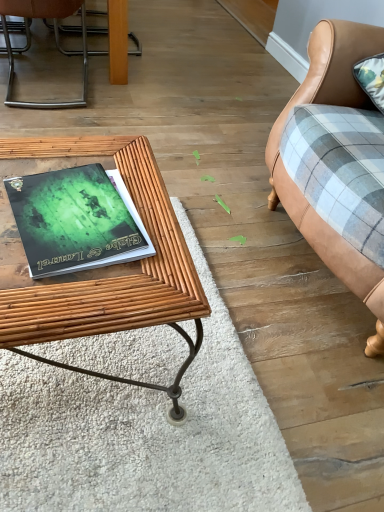
Locate an element on the screen. free space above bambooobject at left (from a real-world perspective) is located at coordinates (79, 209).